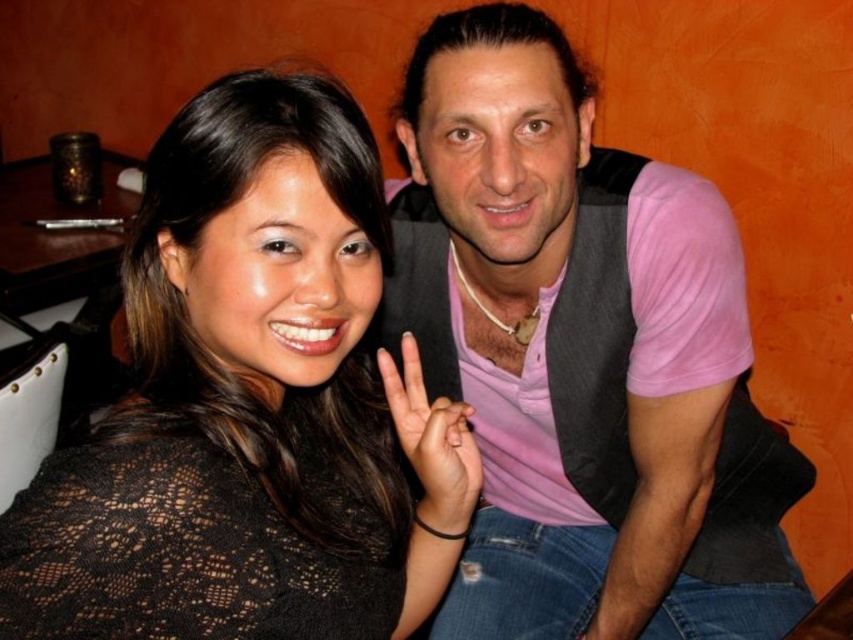
Is black lace top at center smaller than black lace hand at center?

Actually, black lace top at center might be larger than black lace hand at center.

Is point (256, 344) farther from camera compared to point (392, 416)?

That is False.

I want to click on black lace top at center, so click(x=248, y=404).

Locate an element on the screen. Image resolution: width=853 pixels, height=640 pixels. black lace top at center is located at coordinates (248, 404).

Is pink fabric vest at upper right to the right of black lace top at center from the viewer's perspective?

Correct, you'll find pink fabric vest at upper right to the right of black lace top at center.

Can you confirm if pink fabric vest at upper right is smaller than black lace top at center?

Incorrect, pink fabric vest at upper right is not smaller in size than black lace top at center.

Find the location of a particular element. The image size is (853, 640). pink fabric vest at upper right is located at coordinates (583, 356).

Which is more to the right, pink fabric vest at upper right or black lace hand at center?

Result: From the viewer's perspective, pink fabric vest at upper right appears more on the right side.

Which is behind, point (596, 177) or point (445, 442)?

The point (596, 177) is behind.

This screenshot has height=640, width=853. I want to click on pink fabric vest at upper right, so tap(583, 356).